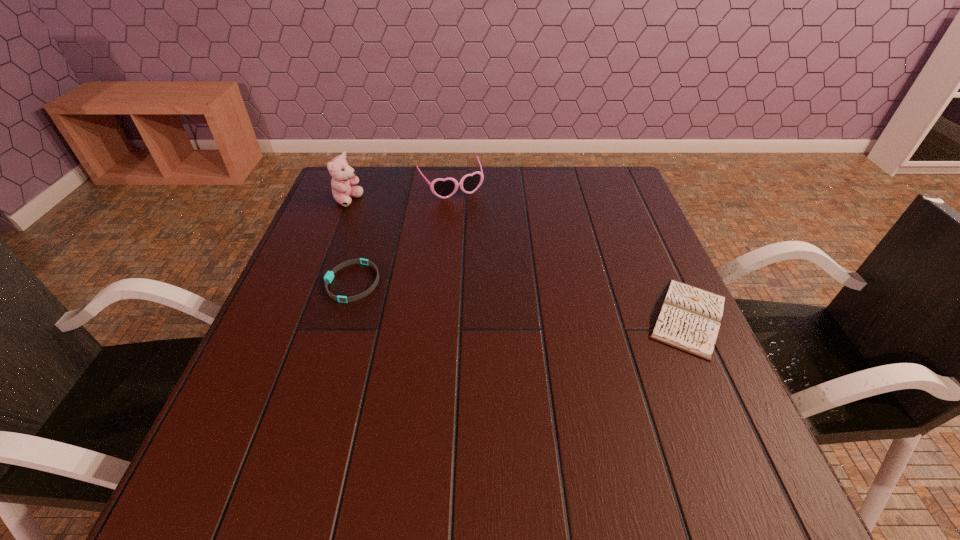
Where is `the shortest object`? Image resolution: width=960 pixels, height=540 pixels. the shortest object is located at coordinates (328, 277).

I want to click on the rightmost object, so click(689, 319).

Identify the location of diary. (689, 319).

Find the location of a particular element. This screenshot has width=960, height=540. the tallest object is located at coordinates (343, 176).

This screenshot has height=540, width=960. Identify the location of the second tallest object. (443, 188).

Identify the location of the second object from right to left. This screenshot has height=540, width=960. (443, 188).

The height and width of the screenshot is (540, 960). Find the location of `vacant position located on the back of the second shortest object`. vacant position located on the back of the second shortest object is located at coordinates (661, 258).

This screenshot has height=540, width=960. I want to click on vacant region located 0.270m at the face of the teddy bear, so click(x=419, y=247).

Where is `vacant space situated 0.220m at the face of the teddy bear`? vacant space situated 0.220m at the face of the teddy bear is located at coordinates (406, 239).

Where is `free space located 0.060m at the face of the teddy bear`? The width and height of the screenshot is (960, 540). free space located 0.060m at the face of the teddy bear is located at coordinates (369, 214).